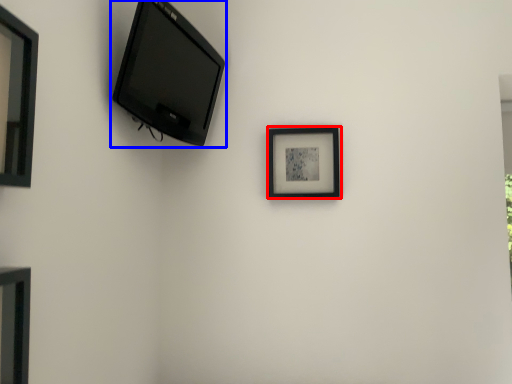
Question: Which of the following is the closest to the observer, picture frame (highlighted by a red box) or television (highlighted by a blue box)?

Choices:
 (A) picture frame
 (B) television

Answer: (B)